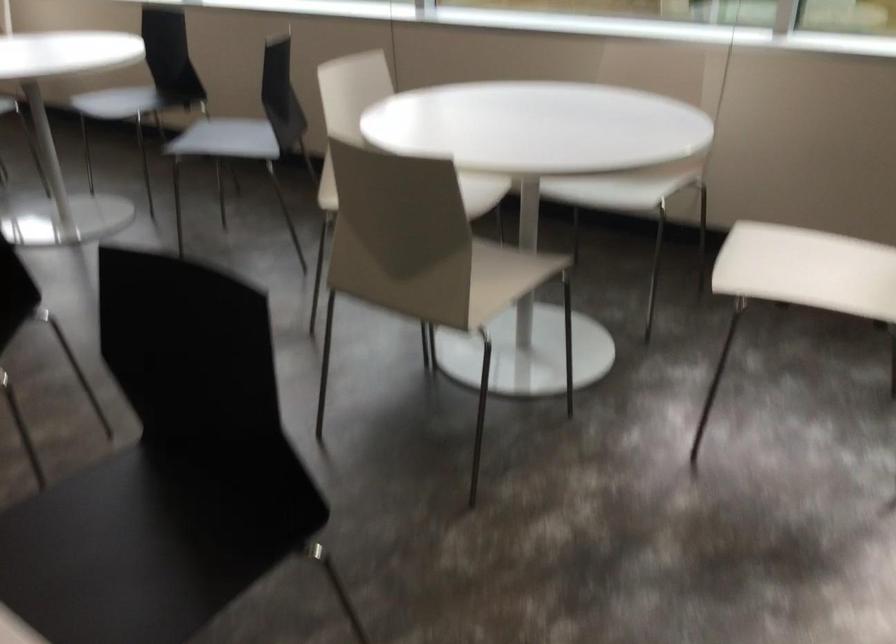
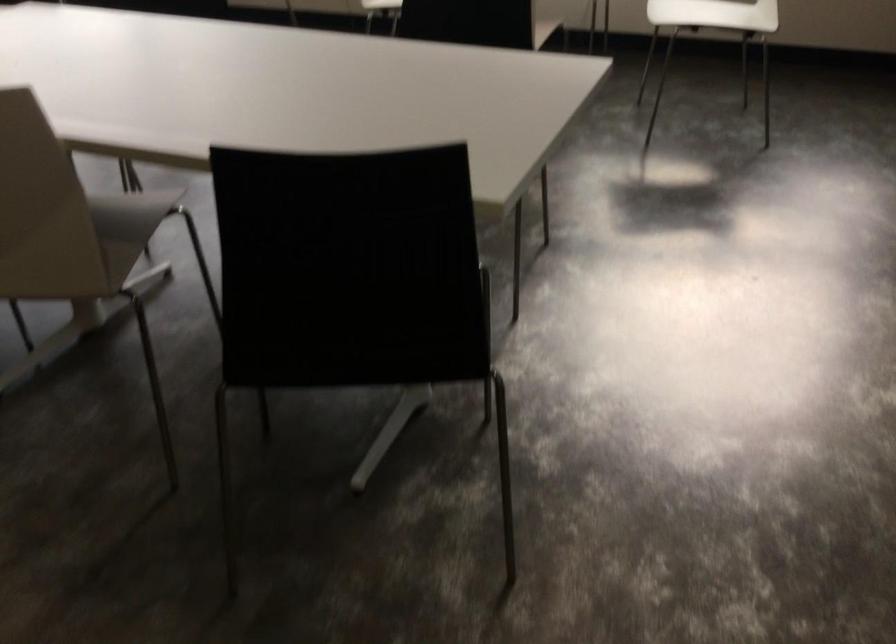
In a continuous first-person perspective shot, in which direction is the camera moving?

The cameraman moved toward left, backward.